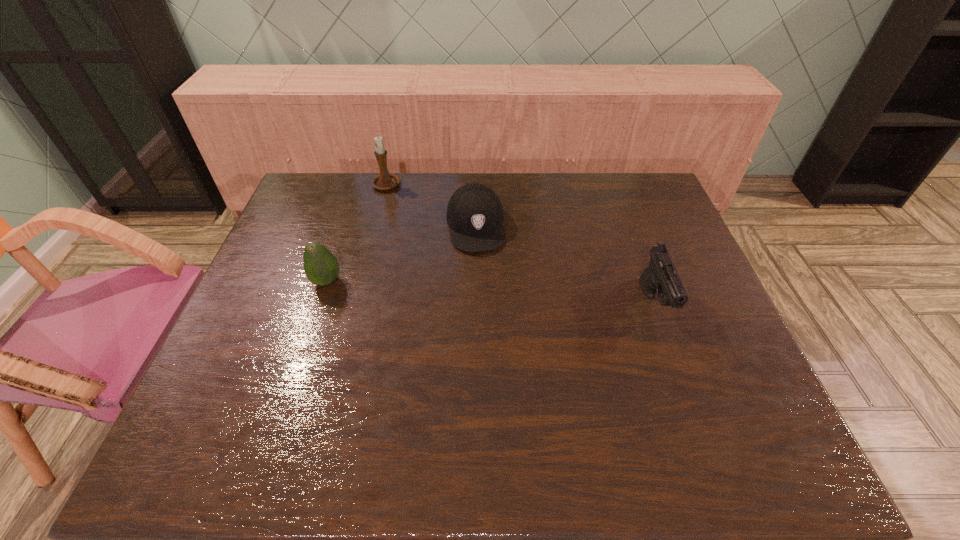
What are the coordinates of `free space on the desktop that is between the avocado and the pistol and is positioned on the front-facing side of the cap` in the screenshot? It's located at (486, 293).

Locate an element on the screen. free space on the desktop that is between the leftmost object and the rightmost object and is positioned on the side of the tallest object with the handle is located at coordinates (456, 291).